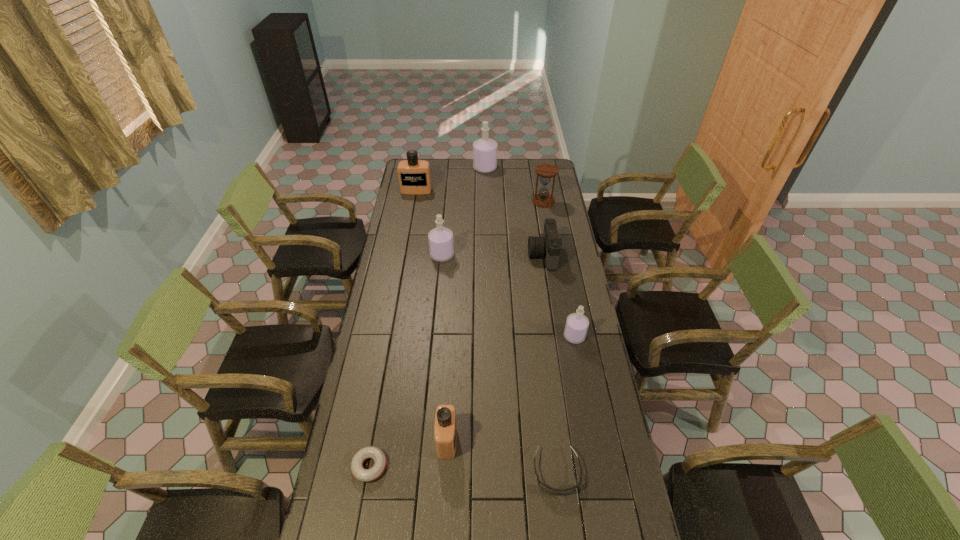
Find the location of a particular element. The width and height of the screenshot is (960, 540). the third closest purple perfume to the black goggles is located at coordinates (485, 149).

Where is `purple perfume that is the second nearest to the second purple perfume from right to left`? The width and height of the screenshot is (960, 540). purple perfume that is the second nearest to the second purple perfume from right to left is located at coordinates (576, 327).

Image resolution: width=960 pixels, height=540 pixels. In order to click on vacant point that satisfies the following two spatial constraints: 1. at the lens of the third shortest object; 2. on the lenses of the black goggles in this screenshot , I will do `click(575, 471)`.

Find the location of a particular element. This screenshot has height=540, width=960. free point that satisfies the following two spatial constraints: 1. on the front side of the nearest purple perfume; 2. on the front label of the right beige perfume is located at coordinates (594, 440).

This screenshot has height=540, width=960. Identify the location of blank space that satisfies the following two spatial constraints: 1. on the front side of the rightmost purple perfume; 2. on the left side of the second perfume from right to left. (488, 336).

Where is `blank area in the image that satisfies the following two spatial constraints: 1. on the back side of the rightmost perfume; 2. at the lens of the camera`? blank area in the image that satisfies the following two spatial constraints: 1. on the back side of the rightmost perfume; 2. at the lens of the camera is located at coordinates [x=559, y=255].